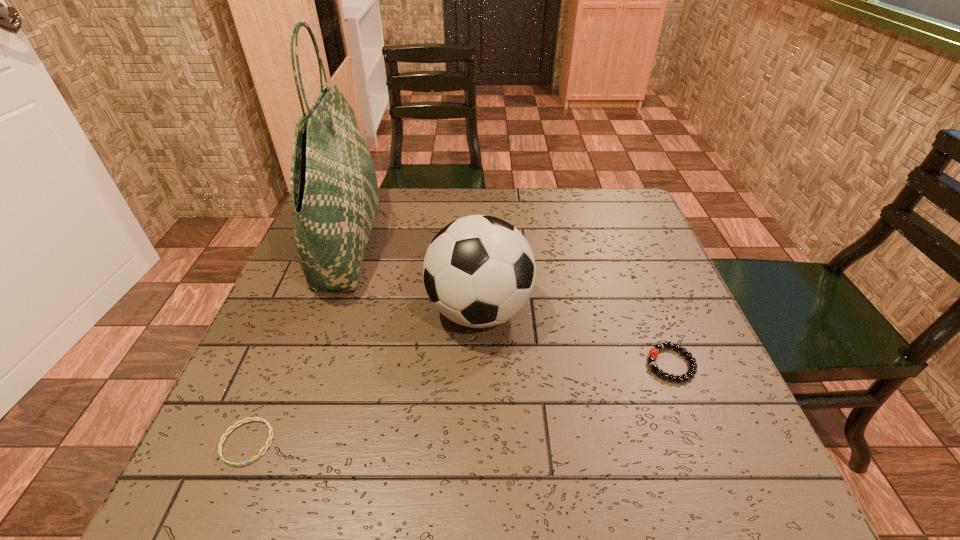
This screenshot has height=540, width=960. Identify the location of vacant space that satisfies the following two spatial constraints: 1. on the front side of the tote bag; 2. on the left side of the farther bracelet. (304, 364).